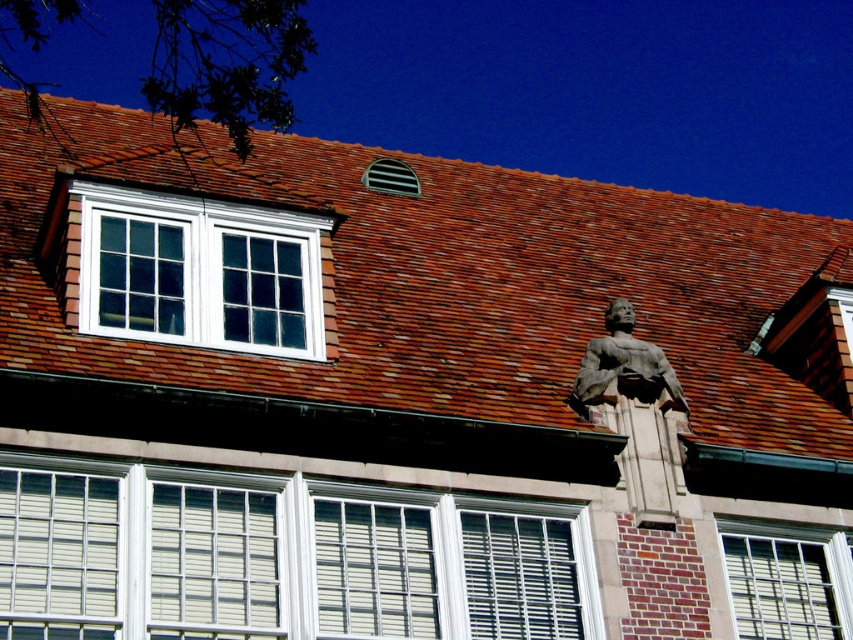
In the scene shown: Does white glass window at upper center appear on the right side of white painted wood window at center?

No, white glass window at upper center is not to the right of white painted wood window at center.

Does white glass window at upper center come in front of white painted wood window at center?

No, white glass window at upper center is further to the viewer.

Does point (84, 211) come closer to viewer compared to point (369, 504)?

No, it is behind (369, 504).

Locate an element on the screen. This screenshot has width=853, height=640. white glass window at upper center is located at coordinates (200, 272).

Which is above, brown tile roof at upper center or white painted wood window at center?

brown tile roof at upper center is above.

Does brown tile roof at upper center appear under white painted wood window at center?

Incorrect, brown tile roof at upper center is not positioned below white painted wood window at center.

Which is in front, point (422, 280) or point (374, 547)?

Point (374, 547) is in front.

Locate an element on the screen. This screenshot has width=853, height=640. brown tile roof at upper center is located at coordinates (454, 282).

Measure the distance from white glass window at upper center to white textured window at lower center.

white glass window at upper center is 26.41 feet from white textured window at lower center.

What do you see at coordinates (200, 272) in the screenshot?
I see `white glass window at upper center` at bounding box center [200, 272].

Where is `white glass window at upper center`? The image size is (853, 640). white glass window at upper center is located at coordinates (200, 272).